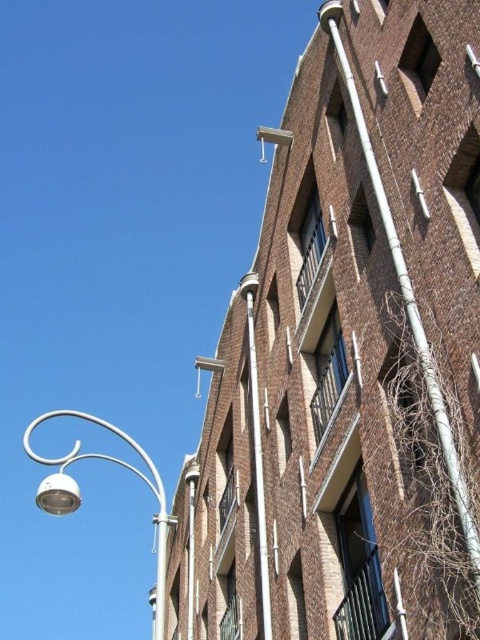
Question: Which point is farther from the camera taking this photo?

Choices:
 (A) (193, 509)
 (B) (252, 355)

Answer: (A)

Question: Among these points, which one is nearest to the camera?

Choices:
 (A) (252, 369)
 (B) (160, 588)

Answer: (B)

Question: In this image, where is metallic silver pole at center located relative to metallic pipe at upper center?

Choices:
 (A) right
 (B) left

Answer: (A)

Question: Is metallic silver streetlight at lower left thinner than metallic silver pole at center?

Choices:
 (A) yes
 (B) no

Answer: (B)

Question: Does metallic silver pole at center come in front of metallic pipe at upper center?

Choices:
 (A) yes
 (B) no

Answer: (A)

Question: Among these objects, which one is nearest to the camera?

Choices:
 (A) metallic silver pole at center
 (B) metallic silver streetlight at lower left
 (C) metallic pipe at upper center

Answer: (B)